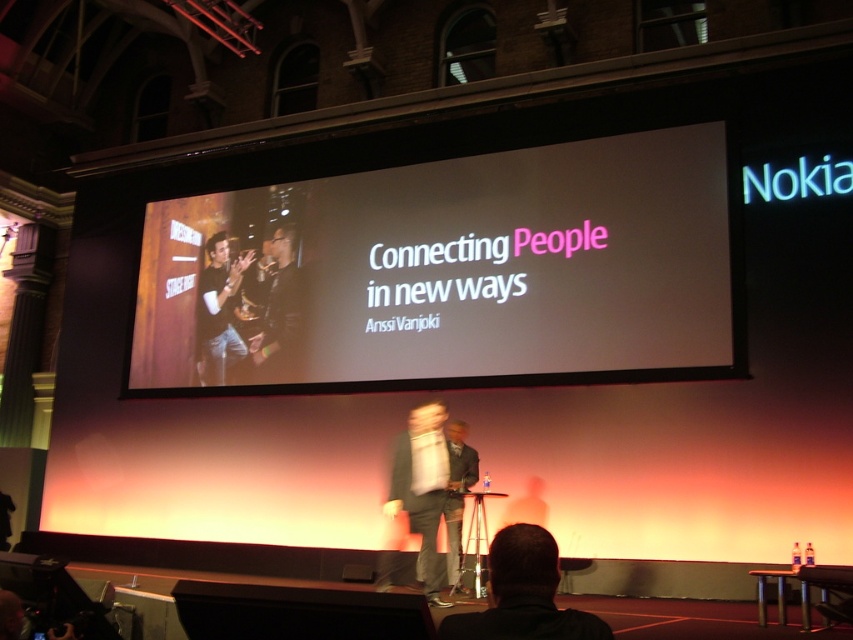
You are an event planner setting up for a presentation. You need to ensure that the dark gray suit at center is visible to the audience without being obscured by the white glossy projection screen at center. Based on their sizes, is this possible?

The white glossy projection screen at center is much taller than the dark gray suit at center, so the screen could potentially obscure the suit if positioned directly in front of it. However, since the screen is at the center and the presenter in the dark gray suit is also at center, adjusting their position slightly to the side or ensuring they step forward when speaking might help keep them visible to the audience.

You are a stagehand preparing to move a 1.5 meter wide equipment cart from the back of the stage to the front. There is a black fabric at lower center and a light gray suit at center on stage. Can the cart pass between them without touching either?

The black fabric at lower center and light gray suit at center are 16.19 meters apart, so yes, the cart can pass between them as the distance is much larger than the cart width.

You are an event organizer setting up for a presentation. You need to place a 1.2 meter wide banner on the stage. The banner must be positioned to the right of the white glossy projection screen at center. Is there enough space on the stage to place the banner there?

The white glossy projection screen at center is located at point (450, 273). Since the banner needs to be placed to the right of it and is 1.2 meters wide, there should be sufficient space as the stage is part of a large hall or auditorium, implying ample room for such arrangements.